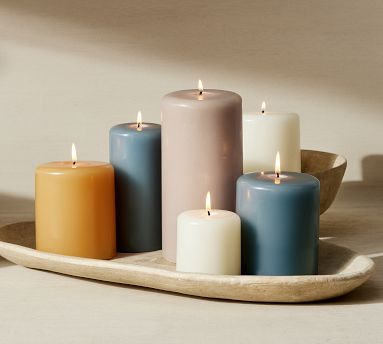
Where is `candles with flames`? This screenshot has height=344, width=383. candles with flames is located at coordinates (132, 154), (184, 127), (204, 233), (258, 199), (267, 121).